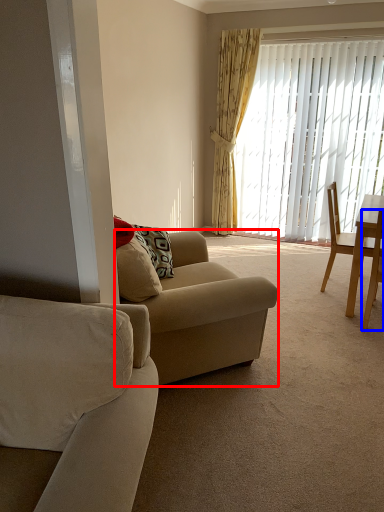
Question: Which object is further to the camera taking this photo, studio couch (highlighted by a red box) or chair (highlighted by a blue box)?

Choices:
 (A) studio couch
 (B) chair

Answer: (B)